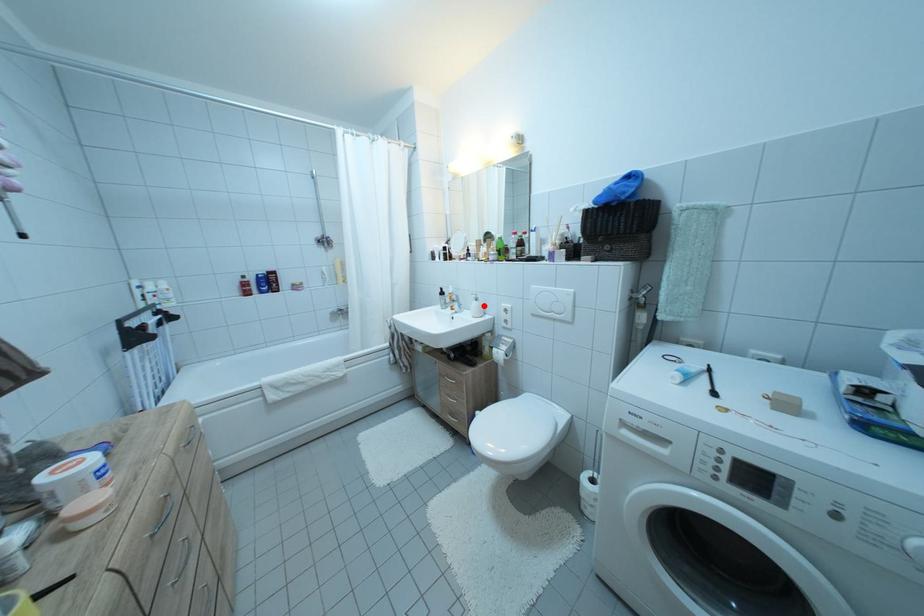
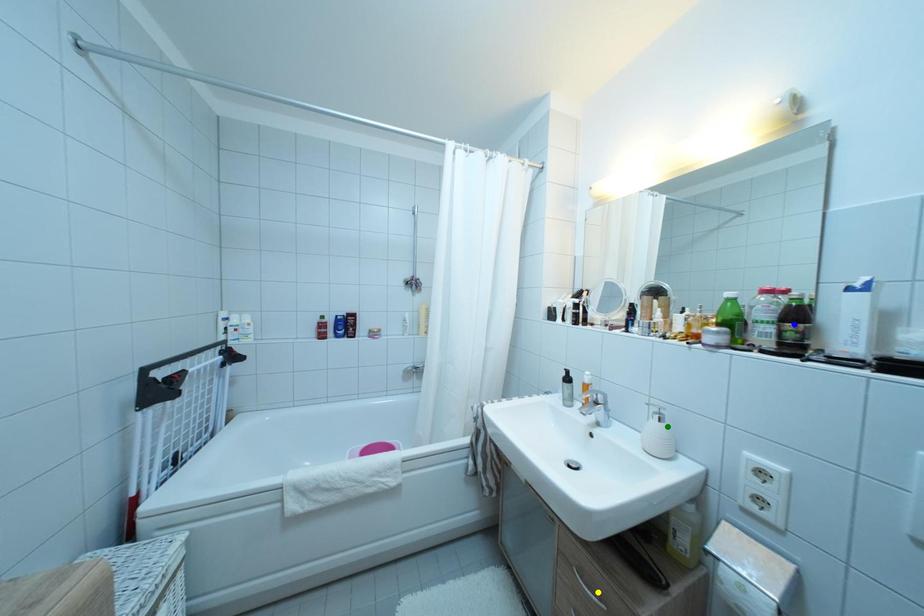
Question: I am providing you with two images of the same scene from different viewpoints. A red point is marked on the first image. You are given multiple points on the second image. Which point in image 2 is actually the same real-world point as the red point in image 1?

Choices:
 (A) yellow point
 (B) blue point
 (C) green point

Answer: (C)